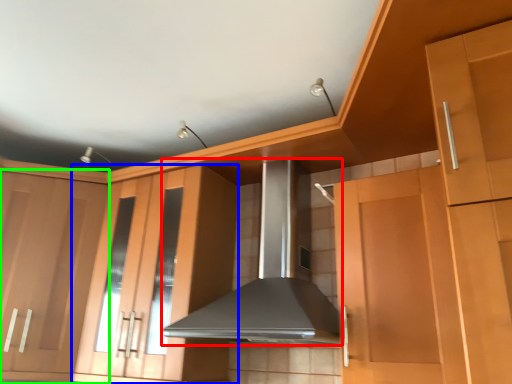
Question: Estimate the real-world distances between objects in this image. Which object is closer to home appliance (highlighted by a red box), cabinetry (highlighted by a blue box) or cabinetry (highlighted by a green box)?

Choices:
 (A) cabinetry
 (B) cabinetry

Answer: (A)